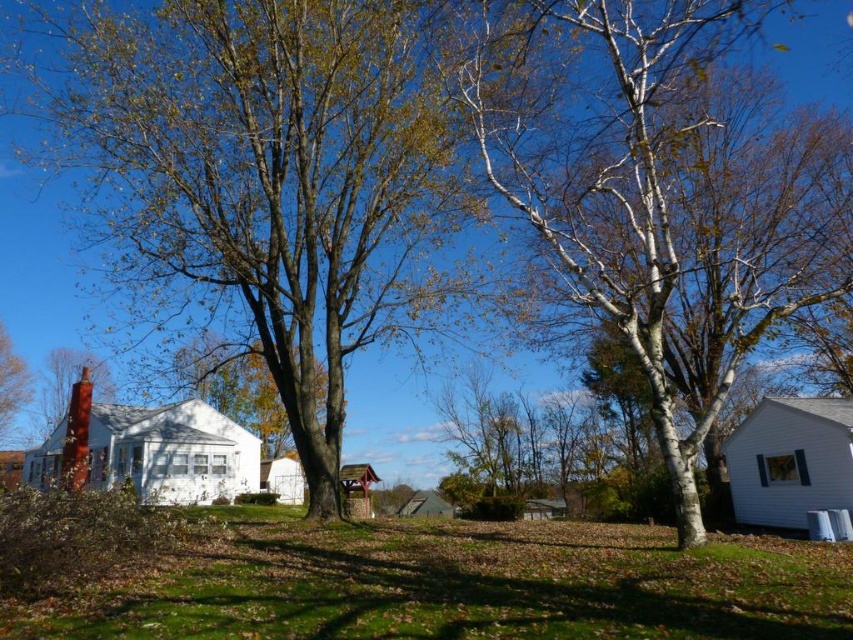
Between point (531, 609) and point (44, 433), which one is positioned behind?

Point (44, 433)

Is point (770, 609) closer to viewer compared to point (55, 362)?

Yes, it is.

What are the coordinates of `green grass at center` in the screenshot? It's located at (469, 586).

Does white smooth birch tree at center appear under smooth red chimney at left?

No, white smooth birch tree at center is not below smooth red chimney at left.

Who is more forward, (358,72) or (39,413)?

Point (358,72) is more forward.

Where is `white smooth birch tree at center`? This screenshot has width=853, height=640. white smooth birch tree at center is located at coordinates pos(294,196).

Can you confirm if white bark birch tree at right is bigger than smooth red chimney at left?

Yes.

Which is behind, point (740, 278) or point (38, 420)?

Positioned behind is point (38, 420).

Where is `white bark birch tree at right`? white bark birch tree at right is located at coordinates pyautogui.click(x=653, y=193).